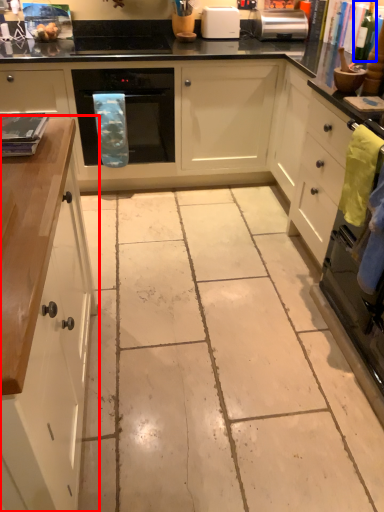
Question: Which of the following is the farthest to the observer, cabinetry (highlighted by a red box) or bottle (highlighted by a blue box)?

Choices:
 (A) cabinetry
 (B) bottle

Answer: (B)